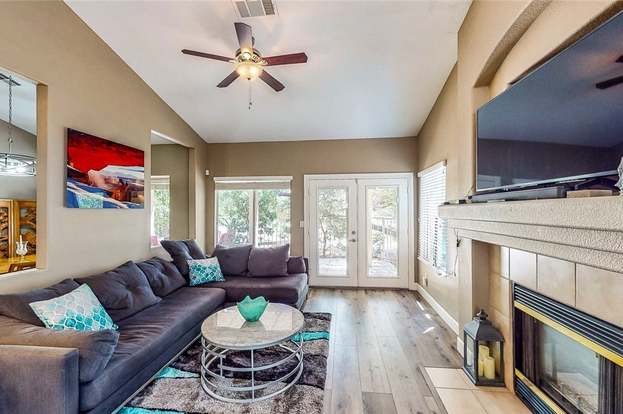
The image size is (623, 414). I want to click on glass doors, so click(381, 211), click(343, 210).